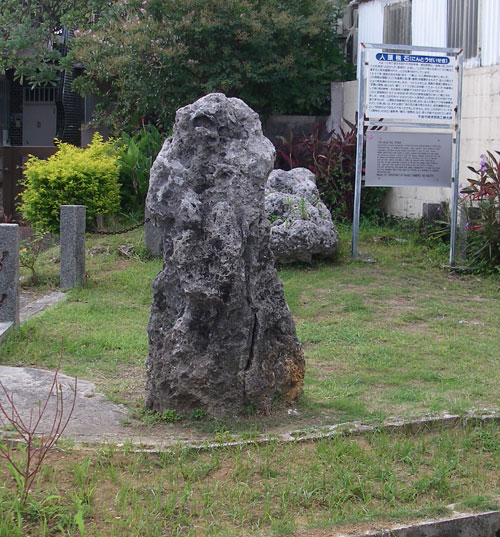
The image size is (500, 537). What are the coordinates of `door` in the screenshot? It's located at (22, 118).